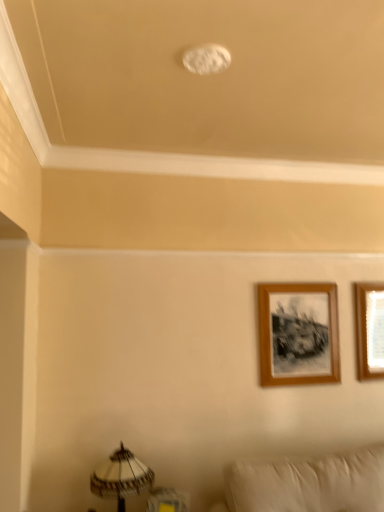
Question: From a real-world perspective, is wooden frame at upper right, which is counted as the 1th picture frame, starting from the left, positioned under wooden picture frame at upper right, the first picture frame when ordered from right to left, based on gravity?

Choices:
 (A) yes
 (B) no

Answer: (A)

Question: Is wooden frame at upper right, positioned as the 2th picture frame in right-to-left order, bigger than wooden picture frame at upper right, the first picture frame when ordered from right to left?

Choices:
 (A) no
 (B) yes

Answer: (B)

Question: Is wooden picture frame at upper right, the first picture frame when ordered from right to left, completely or partially inside wooden frame at upper right, which is counted as the 1th picture frame, starting from the left?

Choices:
 (A) no
 (B) yes

Answer: (A)

Question: Can you confirm if wooden frame at upper right, positioned as the 2th picture frame in right-to-left order, is positioned to the right of wooden picture frame at upper right, the first picture frame when ordered from right to left?

Choices:
 (A) yes
 (B) no

Answer: (B)

Question: Is wooden frame at upper right, positioned as the 2th picture frame in right-to-left order, facing towards wooden picture frame at upper right, which is the second picture frame from left to right?

Choices:
 (A) yes
 (B) no

Answer: (B)

Question: Can you see wooden frame at upper right, positioned as the 2th picture frame in right-to-left order, touching wooden picture frame at upper right, the first picture frame when ordered from right to left?

Choices:
 (A) yes
 (B) no

Answer: (B)

Question: Is wooden frame at upper right, which is counted as the 1th picture frame, starting from the left, looking in the opposite direction of white textured lampshade at lower left?

Choices:
 (A) no
 (B) yes

Answer: (A)

Question: Is white textured lampshade at lower left located within wooden frame at upper right, which is counted as the 1th picture frame, starting from the left?

Choices:
 (A) no
 (B) yes

Answer: (A)

Question: From a real-world perspective, is wooden frame at upper right, which is counted as the 1th picture frame, starting from the left, positioned over white textured lampshade at lower left based on gravity?

Choices:
 (A) yes
 (B) no

Answer: (A)

Question: Is wooden frame at upper right, which is counted as the 1th picture frame, starting from the left, shorter than white textured lampshade at lower left?

Choices:
 (A) yes
 (B) no

Answer: (B)

Question: Is wooden frame at upper right, which is counted as the 1th picture frame, starting from the left, taller than white textured lampshade at lower left?

Choices:
 (A) yes
 (B) no

Answer: (A)

Question: Does wooden frame at upper right, which is counted as the 1th picture frame, starting from the left, have a greater width compared to white textured lampshade at lower left?

Choices:
 (A) yes
 (B) no

Answer: (B)

Question: Is wooden picture frame at upper right, which is the second picture frame from left to right, shorter than white textured lampshade at lower left?

Choices:
 (A) no
 (B) yes

Answer: (A)